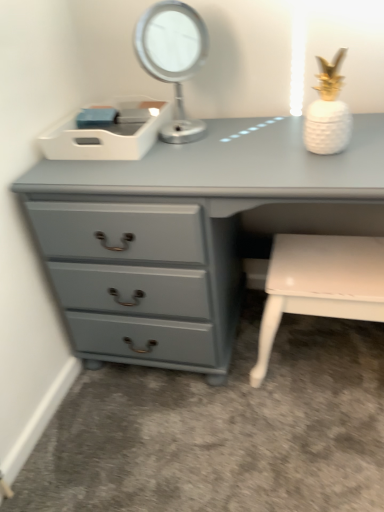
The height and width of the screenshot is (512, 384). Find the location of `vacant area that is in front of matte gray chest of drawers at center`. vacant area that is in front of matte gray chest of drawers at center is located at coordinates (237, 450).